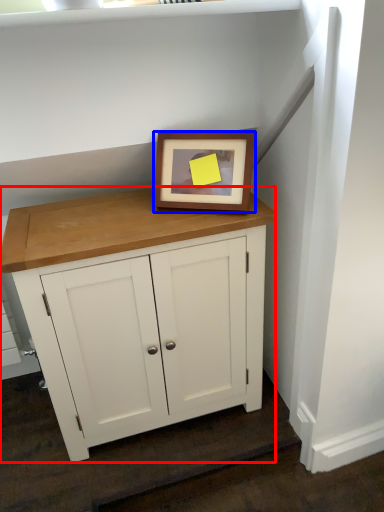
Question: Which object appears closest to the camera in this image, table (highlighted by a red box) or picture frame (highlighted by a blue box)?

Choices:
 (A) table
 (B) picture frame

Answer: (A)